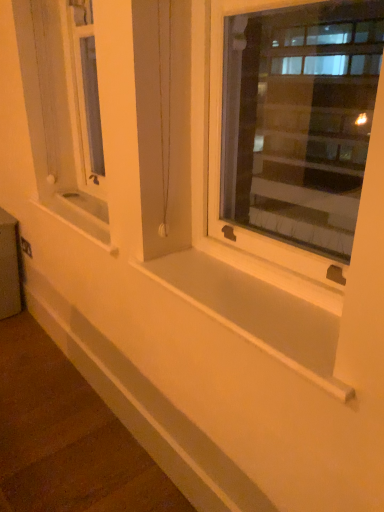
Question: Is metallic silver window box at lower left to the left or to the right of white plastic window at center in the image?

Choices:
 (A) left
 (B) right

Answer: (A)

Question: Considering their positions, is metallic silver window box at lower left located in front of or behind white plastic window at center?

Choices:
 (A) front
 (B) behind

Answer: (B)

Question: Which of these objects is positioned farthest from the white smooth window sill at center, the second window sill positioned from the bottom?

Choices:
 (A) white smooth window sill at center, which is the 1th window sill in bottom-to-top order
 (B) white smooth ledge at lower center
 (C) metallic silver window box at lower left
 (D) white plastic window at center

Answer: (D)

Question: Considering the real-world distances, which object is farthest from the white smooth ledge at lower center?

Choices:
 (A) white smooth window sill at center, which is counted as the first window sill, starting from the back
 (B) white smooth window sill at center, acting as the 1th window sill starting from the front
 (C) white plastic window at center
 (D) metallic silver window box at lower left

Answer: (C)